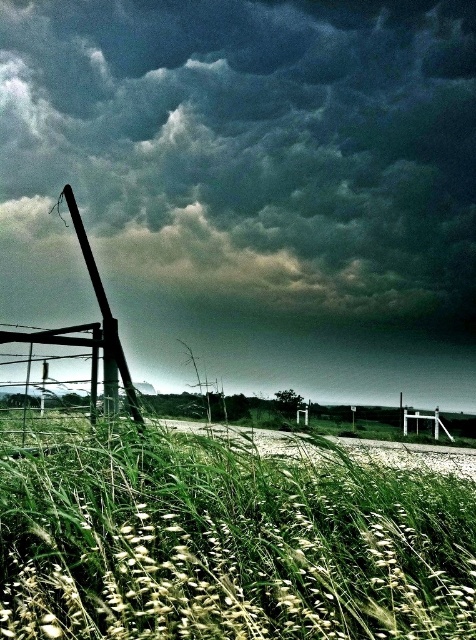
Who is more forward, (345, 157) or (132, 397)?

Point (132, 397)

Is point (278, 12) positioned before point (130, 408)?

No, (278, 12) is further to viewer.

Does point (415, 300) lie behind point (119, 348)?

Yes, point (415, 300) is farther from viewer.

Identify the location of dark gray cloud at upper center. This screenshot has width=476, height=640. (250, 186).

Looking at this image, between dark gray cloud at upper center and green grassy at lower center, which one appears on the right side from the viewer's perspective?

dark gray cloud at upper center

This screenshot has height=640, width=476. Describe the element at coordinates (250, 186) in the screenshot. I see `dark gray cloud at upper center` at that location.

Locate an element on the screen. This screenshot has width=476, height=640. dark gray cloud at upper center is located at coordinates (x=250, y=186).

Does point (383, 513) lie behind point (138, 416)?

No, it is not.

Does green grassy at lower center appear under metallic pole at left?

Correct, green grassy at lower center is located below metallic pole at left.

Is point (218, 552) closer to camera compared to point (89, 244)?

Yes, it is.

Identify the location of green grassy at lower center. (228, 544).